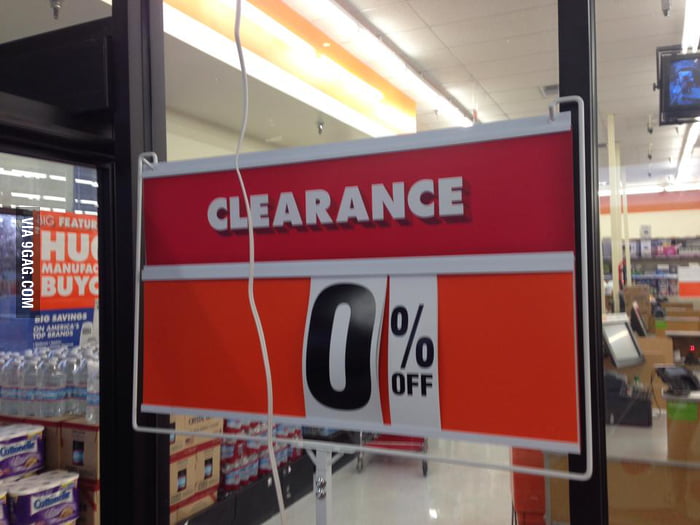
Locate an element on the screen. bottles of water is located at coordinates (40, 392).